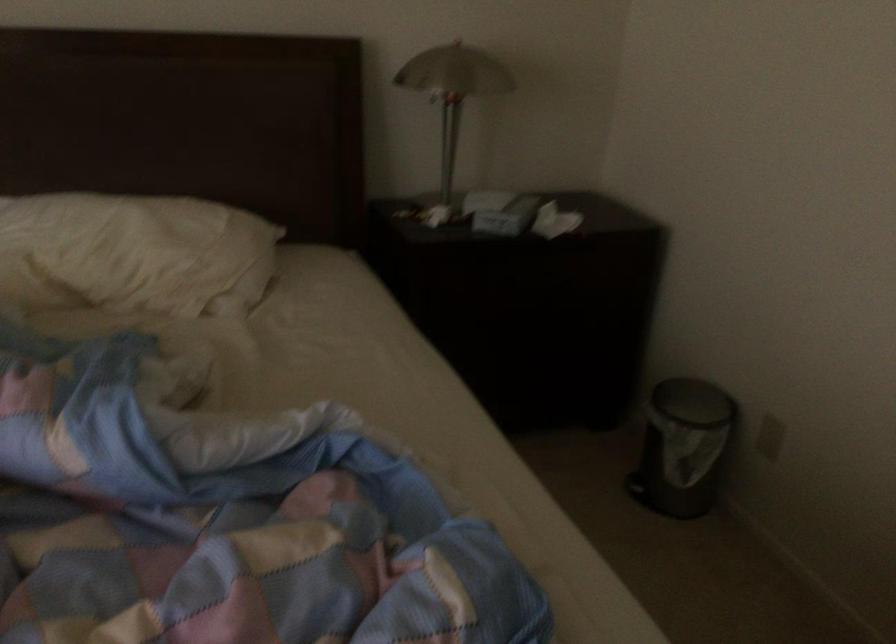
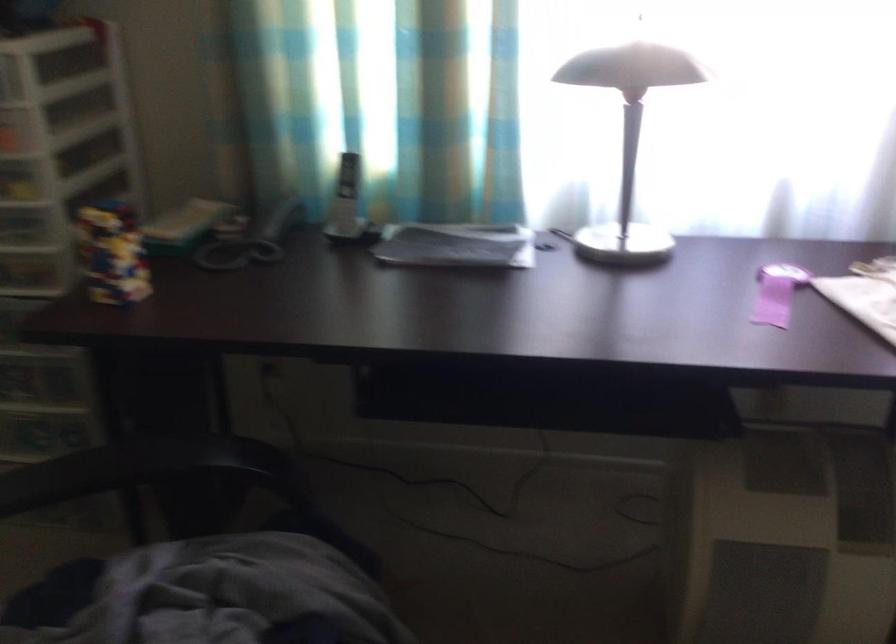
Based on the photo, the images are taken continuously from a first-person perspective. In which direction is your viewpoint rotating?

The rotation direction of the camera is left-down.